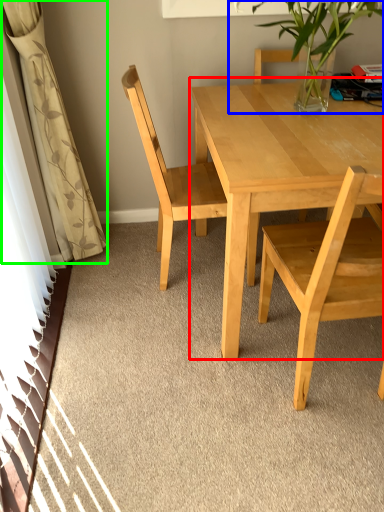
Question: Which object is the farthest from coffee table (highlighted by a red box)? Choose among these: houseplant (highlighted by a blue box) or curtain (highlighted by a green box).

Choices:
 (A) houseplant
 (B) curtain

Answer: (B)